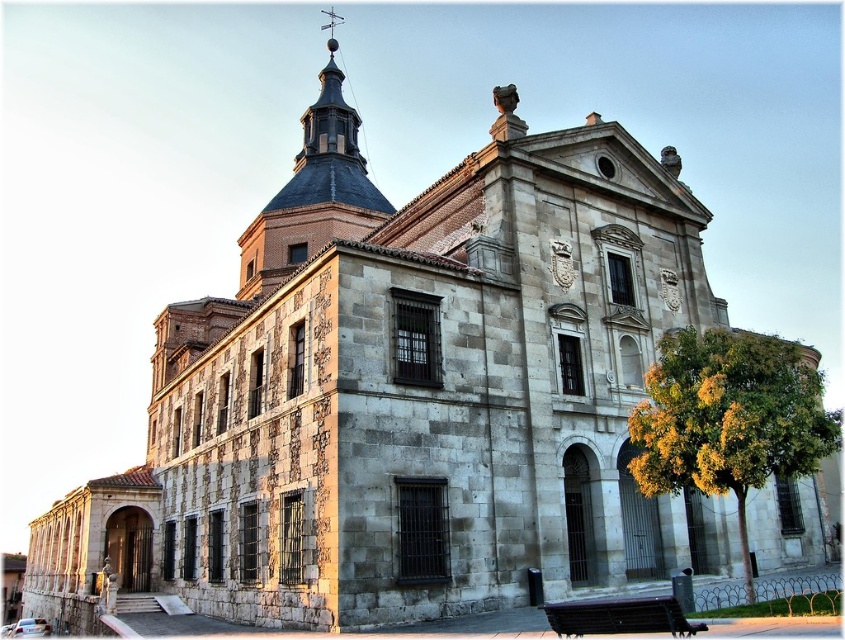
Is smooth stone spire at upper center to the right of wooden bench at lower center from the viewer's perspective?

No, smooth stone spire at upper center is not to the right of wooden bench at lower center.

Is smooth stone spire at upper center further to camera compared to wooden bench at lower center?

Yes, smooth stone spire at upper center is further from the viewer.

Between point (293, 182) and point (657, 611), which one is positioned in front?

Point (657, 611) is more forward.

Image resolution: width=845 pixels, height=640 pixels. In order to click on smooth stone spire at upper center in this screenshot , I will do `click(313, 189)`.